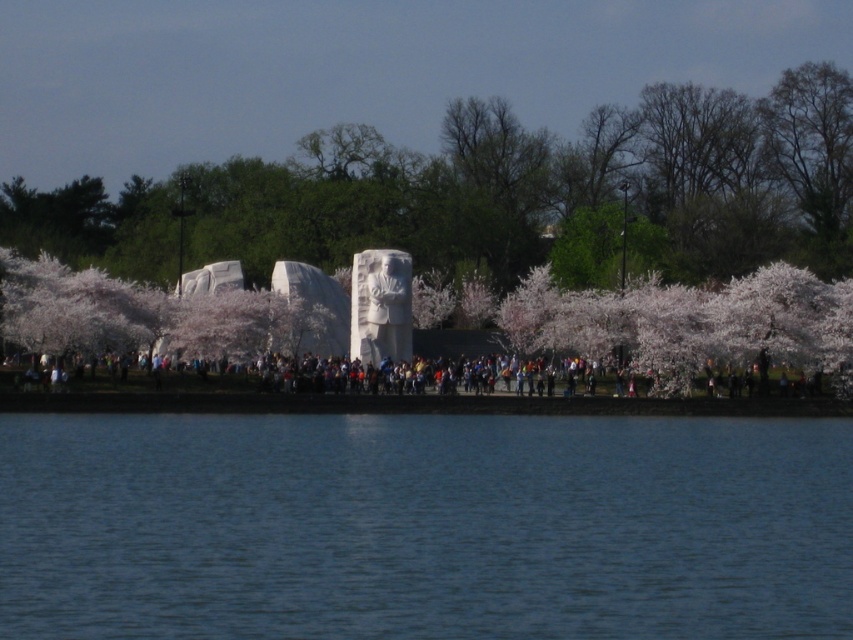
Which is in front, point (328, 179) or point (358, 388)?

Positioned in front is point (358, 388).

Can you confirm if white stone sculpture at center is positioned below multicolored clothing at center?

Incorrect, white stone sculpture at center is not positioned below multicolored clothing at center.

Which is in front, point (68, 202) or point (187, 387)?

Point (187, 387) is more forward.

The height and width of the screenshot is (640, 853). Identify the location of white stone sculpture at center. (498, 193).

Which of these two, blue water at lower center or white stone sculpture at center, stands taller?

white stone sculpture at center

Can you confirm if blue water at lower center is positioned above white stone sculpture at center?

Incorrect, blue water at lower center is not positioned above white stone sculpture at center.

Locate an element on the screen. This screenshot has width=853, height=640. blue water at lower center is located at coordinates (422, 525).

Is blue water at lower center positioned before multicolored clothing at center?

Yes, blue water at lower center is closer to the viewer.

Can you confirm if blue water at lower center is positioned above multicolored clothing at center?

Incorrect, blue water at lower center is not positioned above multicolored clothing at center.

Find the location of `blue water at lower center`. blue water at lower center is located at coordinates (422, 525).